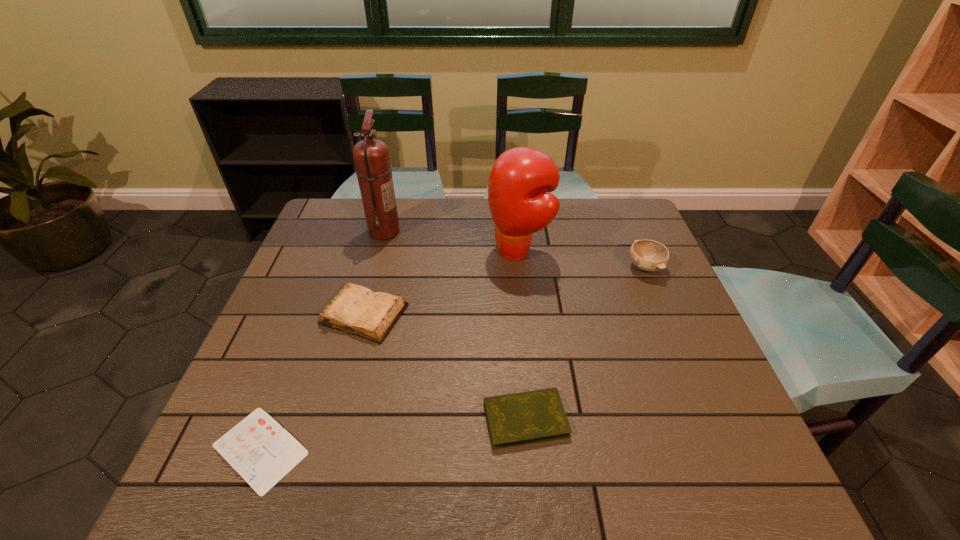
This screenshot has width=960, height=540. Find the location of `object located at the right edge`. object located at the right edge is located at coordinates (648, 255).

At what (x,y) coordinates should I click in order to perform the action: click on object present at the near left corner. Please return your answer as a coordinate pair (x, y). Looking at the image, I should click on (262, 452).

This screenshot has width=960, height=540. I want to click on free space at the far edge of the desktop, so click(x=579, y=202).

The width and height of the screenshot is (960, 540). I want to click on vacant area at the near edge, so click(641, 477).

I want to click on free space at the left edge of the desktop, so click(x=351, y=254).

In the image, there is a desktop. Where is `free space at the right edge`? The image size is (960, 540). free space at the right edge is located at coordinates (612, 275).

Where is `blank space at the far left corner of the desktop`? The height and width of the screenshot is (540, 960). blank space at the far left corner of the desktop is located at coordinates (329, 212).

In the image, there is a desktop. Identify the location of vacant space at the near left corner. This screenshot has width=960, height=540. (233, 488).

The width and height of the screenshot is (960, 540). Find the location of `vacant space at the far right corner of the desktop`. vacant space at the far right corner of the desktop is located at coordinates (636, 238).

At what (x,y) coordinates should I click in order to perform the action: click on vacant space that's between the boxing glove and the bowl. Please return your answer as a coordinate pair (x, y). The height and width of the screenshot is (540, 960). Looking at the image, I should click on (582, 259).